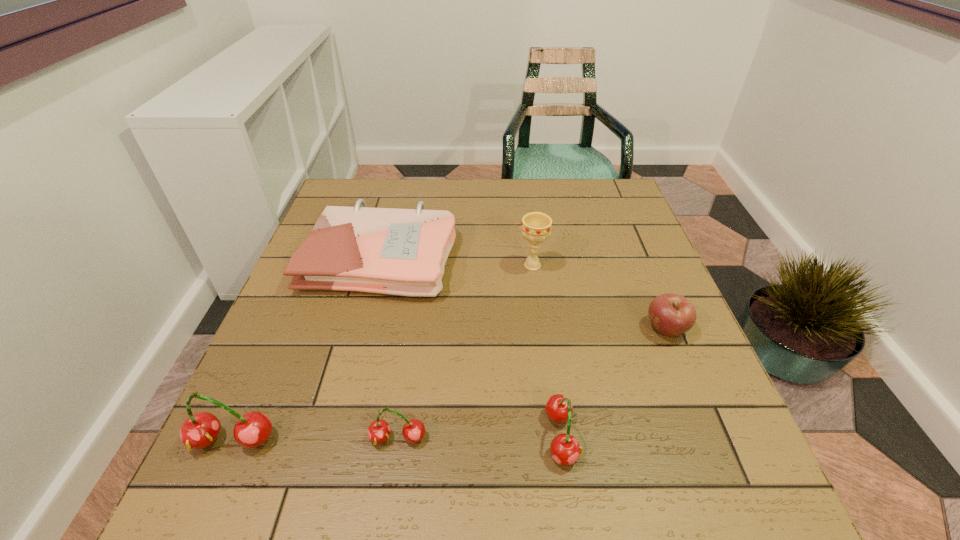
The height and width of the screenshot is (540, 960). Find the location of `free location at the far edge of the desktop`. free location at the far edge of the desktop is located at coordinates (539, 179).

At what (x,y) coordinates should I click in order to perform the action: click on free space at the near edge. Please return your answer as a coordinate pair (x, y). The image size is (960, 540). Looking at the image, I should click on (475, 427).

In the image, there is a desktop. Identify the location of vacant space at the left edge. This screenshot has width=960, height=540. (307, 340).

In the image, there is a desktop. Where is `free space at the right edge`? free space at the right edge is located at coordinates (x=644, y=354).

This screenshot has width=960, height=540. What are the coordinates of `vacant space at the far left corner of the desktop` in the screenshot? It's located at (367, 187).

In the image, there is a desktop. In order to click on vacant region at the far right corner in this screenshot , I will do pos(614,193).

Image resolution: width=960 pixels, height=540 pixels. Find the location of `vacant area between the chalice and the tallest cherry`. vacant area between the chalice and the tallest cherry is located at coordinates (383, 353).

This screenshot has height=540, width=960. I want to click on free space between the shortest cherry and the phonebook, so click(x=390, y=347).

Where is `free space that is in between the shortest cherry and the tallest cherry`? free space that is in between the shortest cherry and the tallest cherry is located at coordinates pyautogui.click(x=315, y=440).

The image size is (960, 540). I want to click on unoccupied area between the chalice and the phonebook, so click(x=457, y=261).